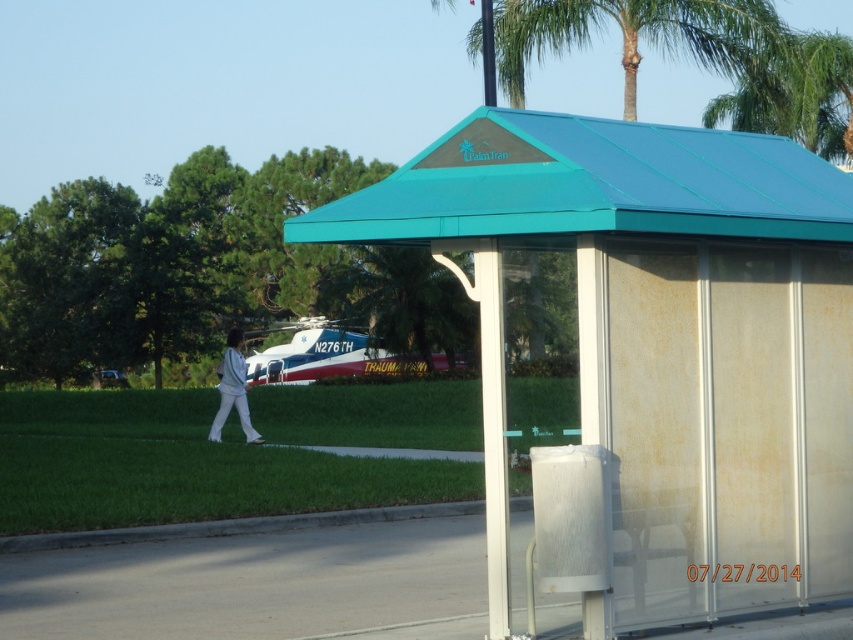
Question: Among these objects, which one is nearest to the camera?

Choices:
 (A) teal plastic bus stop at center
 (B) green leafy palm tree at center
 (C) white fabric pants at lower left
 (D) green leafy palm tree at upper center

Answer: (A)

Question: Which point is closer to the camera?

Choices:
 (A) teal plastic bus stop at center
 (B) teal metal roof at upper center
 (C) green leafy palm tree at center
 (D) white fabric pants at lower left

Answer: (B)

Question: Is green leafy palm tree at upper center in front of green leafy palm tree at center?

Choices:
 (A) no
 (B) yes

Answer: (A)

Question: Is teal metal roof at upper center closer to the viewer compared to green leafy palm tree at upper center?

Choices:
 (A) no
 (B) yes

Answer: (B)

Question: Which object appears farthest from the camera in this image?

Choices:
 (A) white fabric pants at lower left
 (B) teal plastic bus stop at center
 (C) green leafy palm tree at upper center

Answer: (A)

Question: Is teal metal roof at upper center behind white fabric pants at lower left?

Choices:
 (A) yes
 (B) no

Answer: (B)